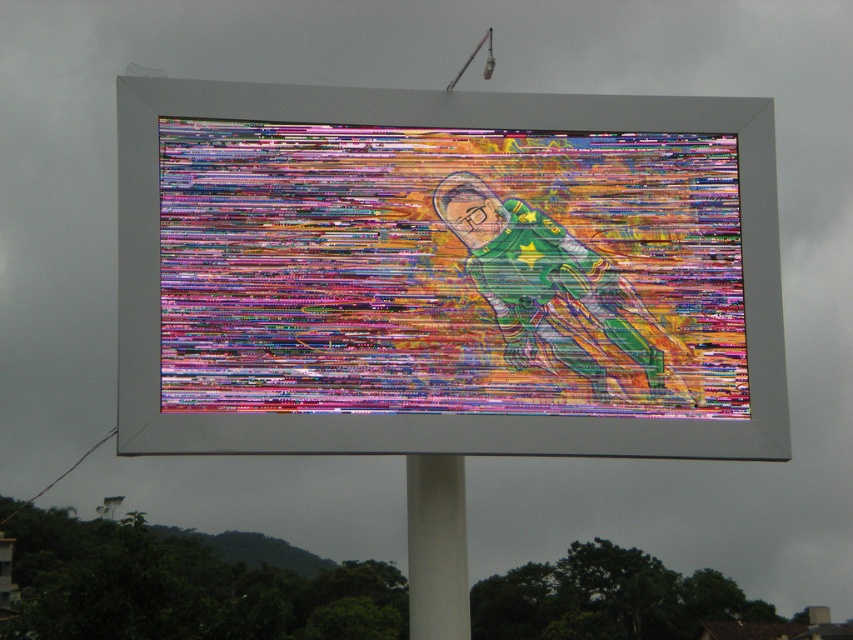
Question: Is glitchy digital art at center in front of white matte pole at center?

Choices:
 (A) yes
 (B) no

Answer: (A)

Question: Which of the following is the farthest from the observer?

Choices:
 (A) white matte pole at center
 (B) glitchy digital art at center

Answer: (A)

Question: Does glitchy digital art at center appear on the right side of white matte pole at center?

Choices:
 (A) yes
 (B) no

Answer: (A)

Question: Is glitchy digital art at center thinner than white matte pole at center?

Choices:
 (A) no
 (B) yes

Answer: (A)